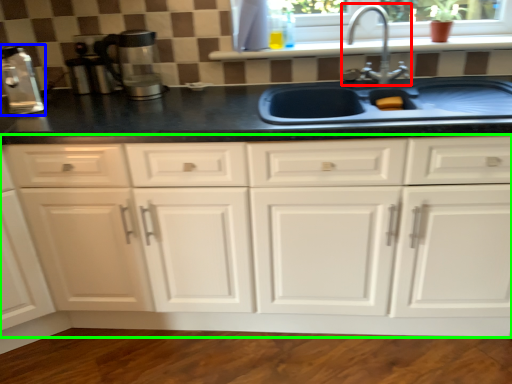
Question: Which object is positioned closest to tap (highlighted by a red box)? Select from coffee machine (highlighted by a blue box) and cabinetry (highlighted by a green box).

Choices:
 (A) coffee machine
 (B) cabinetry

Answer: (B)